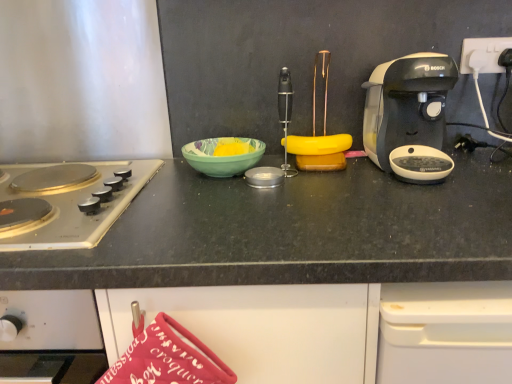
Question: Should I look upward or downward to see green glossy bowl at center?

Choices:
 (A) down
 (B) up

Answer: (B)

Question: From a real-world perspective, is white plastic power outlet at upper right positioned under silver/golden metallic gas stove at left based on gravity?

Choices:
 (A) yes
 (B) no

Answer: (B)

Question: From the image's perspective, is white plastic power outlet at upper right located beneath silver/golden metallic gas stove at left?

Choices:
 (A) yes
 (B) no

Answer: (B)

Question: Is white plastic power outlet at upper right bigger than silver/golden metallic gas stove at left?

Choices:
 (A) yes
 (B) no

Answer: (B)

Question: From the image's perspective, is white plastic power outlet at upper right on top of silver/golden metallic gas stove at left?

Choices:
 (A) yes
 (B) no

Answer: (A)

Question: Is white plastic power outlet at upper right turned away from silver/golden metallic gas stove at left?

Choices:
 (A) no
 (B) yes

Answer: (A)

Question: Is white plastic power outlet at upper right thinner than silver/golden metallic gas stove at left?

Choices:
 (A) no
 (B) yes

Answer: (B)

Question: Does black plastic coffee maker at right have a smaller size compared to white plastic power outlet at upper right?

Choices:
 (A) yes
 (B) no

Answer: (B)

Question: Is black plastic coffee maker at right oriented towards white plastic power outlet at upper right?

Choices:
 (A) yes
 (B) no

Answer: (B)

Question: Is black plastic coffee maker at right touching white plastic power outlet at upper right?

Choices:
 (A) no
 (B) yes

Answer: (A)

Question: Can you confirm if black plastic coffee maker at right is bigger than white plastic power outlet at upper right?

Choices:
 (A) no
 (B) yes

Answer: (B)

Question: Is black plastic coffee maker at right at the right side of white plastic power outlet at upper right?

Choices:
 (A) yes
 (B) no

Answer: (B)

Question: From the image's perspective, is black plastic coffee maker at right below white plastic power outlet at upper right?

Choices:
 (A) yes
 (B) no

Answer: (A)

Question: Can you confirm if white plastic power outlet at upper right is taller than green glossy bowl at center?

Choices:
 (A) no
 (B) yes

Answer: (B)